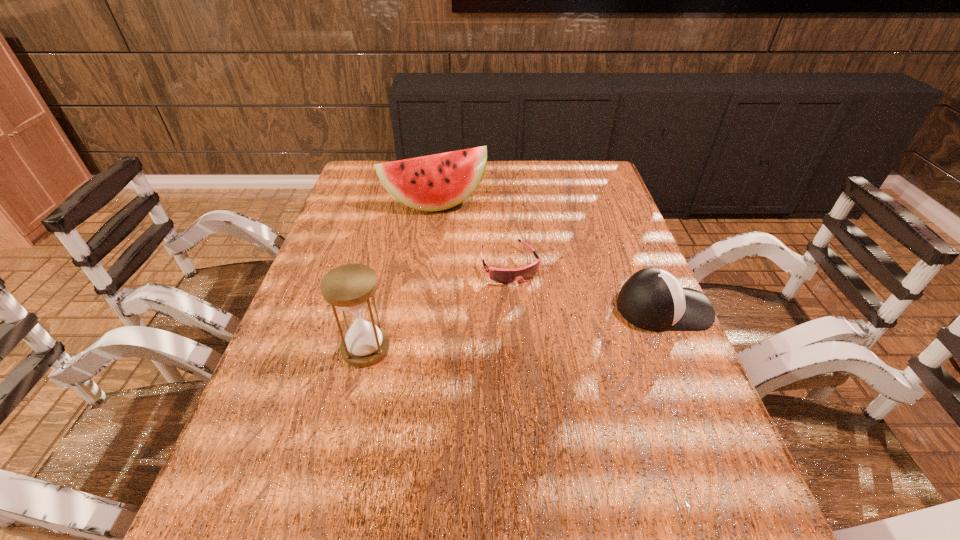
Image resolution: width=960 pixels, height=540 pixels. I want to click on vacant region at the right edge of the desktop, so click(605, 259).

Locate an element on the screen. blank area at the far left corner is located at coordinates (368, 183).

At what (x,y) coordinates should I click in order to perform the action: click on free point between the third nearest object and the watermelon. Please return your answer as a coordinate pair (x, y). Looking at the image, I should click on pos(472,234).

In order to click on vacant area that lies between the hourglass and the rightmost object in this screenshot , I will do pyautogui.click(x=515, y=328).

Identify the location of free area in between the farthest object and the hourglass. The width and height of the screenshot is (960, 540). (400, 276).

Where is `unoccupied position between the hourglass and the watermelon`? The image size is (960, 540). unoccupied position between the hourglass and the watermelon is located at coordinates (400, 276).

This screenshot has width=960, height=540. I want to click on free point between the hourglass and the cap, so click(515, 328).

Find the location of a particular element. This screenshot has width=960, height=540. free space between the hourglass and the farthest object is located at coordinates (400, 276).

Identify the location of free space between the cap and the shortest object. The width and height of the screenshot is (960, 540). (587, 287).

The width and height of the screenshot is (960, 540). I want to click on vacant area that lies between the hourglass and the shortest object, so click(x=438, y=307).